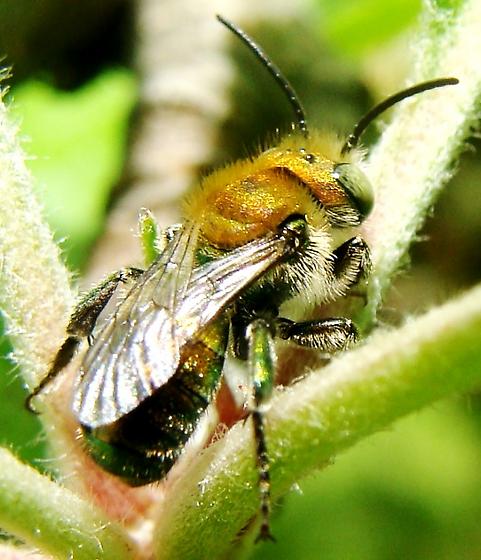
You are a GUI agent. You are given a task and a screenshot of the screen. Output one action in this format:
    pyautogui.click(x=<x>, y=<y>)
    Task: Click on the plant
    
    Given the screenshot: What is the action you would take?
    pyautogui.click(x=336, y=404), pyautogui.click(x=234, y=492), pyautogui.click(x=70, y=534), pyautogui.click(x=35, y=304), pyautogui.click(x=22, y=235)